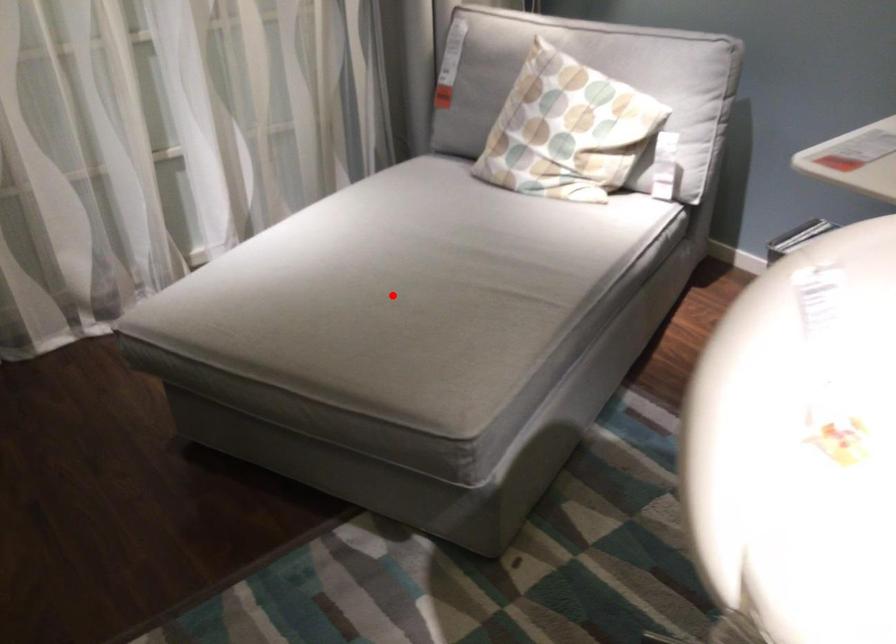
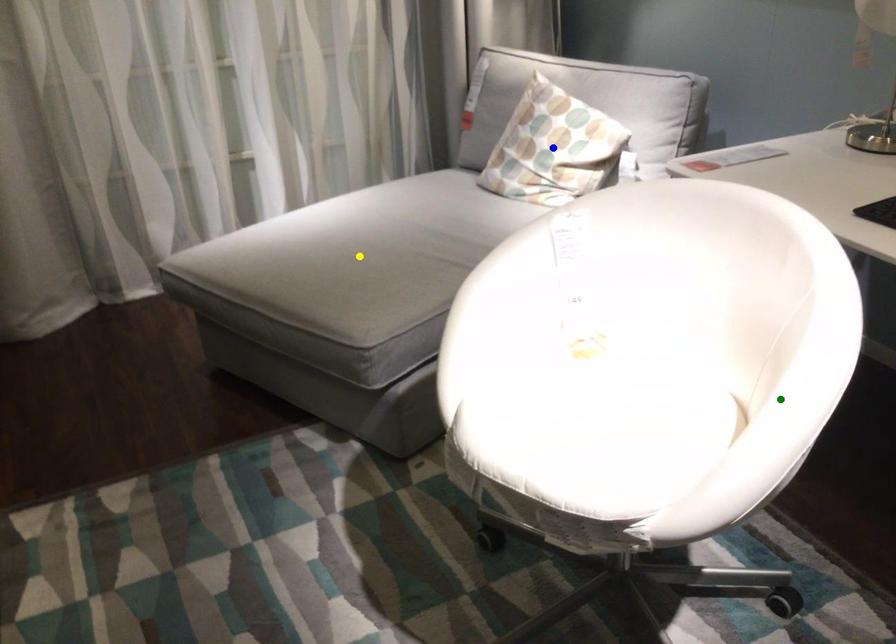
Question: I am providing you with two images of the same scene from different viewpoints. A red point is marked on the first image. You are given multiple points on the second image. Can you choose the point in image 2 that corresponds to the point in image 1?

Choices:
 (A) yellow point
 (B) blue point
 (C) green point

Answer: (A)